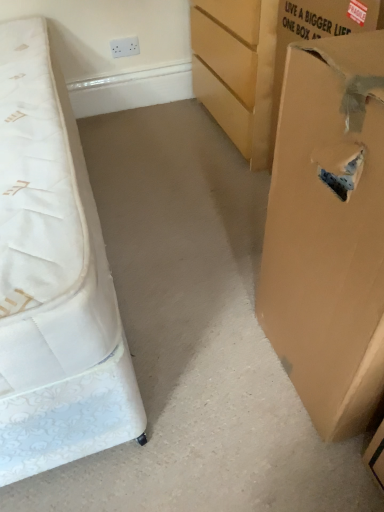
Where is `vacant space to the right of white quilted mattress at left`? vacant space to the right of white quilted mattress at left is located at coordinates (191, 225).